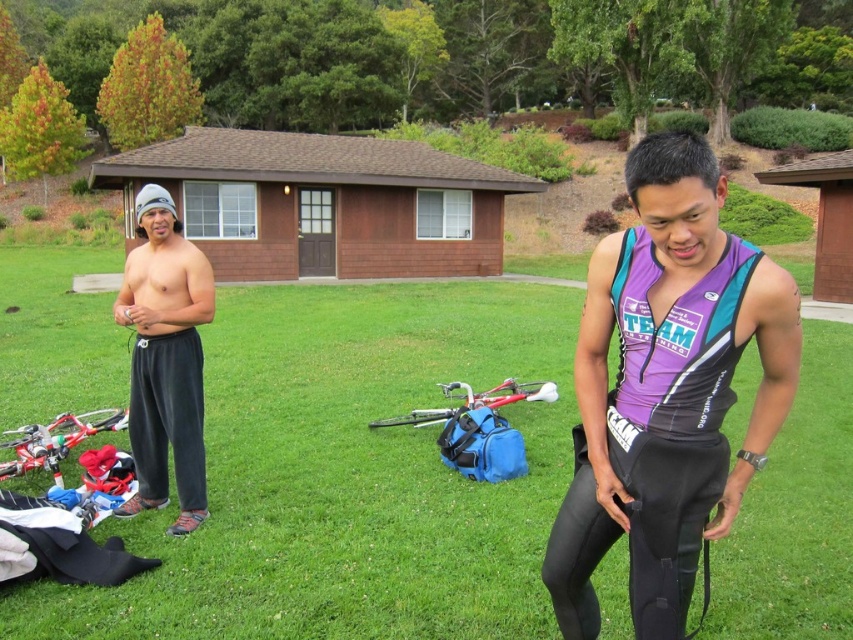
Question: Estimate the real-world distances between objects in this image. Which object is farther from the purple fabric triathlon suit at center?

Choices:
 (A) gray sweatpants at left
 (B) green grass at center

Answer: (B)

Question: Is green grass at center to the left of purple fabric triathlon suit at center from the viewer's perspective?

Choices:
 (A) yes
 (B) no

Answer: (A)

Question: Which point appears farthest from the camera in this image?

Choices:
 (A) (94, 605)
 (B) (585, 515)
 (C) (207, 278)

Answer: (C)

Question: From the image, what is the correct spatial relationship of green grass at center in relation to gray sweatpants at left?

Choices:
 (A) right
 (B) left

Answer: (A)

Question: Which object appears closest to the camera in this image?

Choices:
 (A) green grass at center
 (B) purple fabric triathlon suit at center
 (C) gray sweatpants at left

Answer: (B)

Question: Is green grass at center further to the viewer compared to gray sweatpants at left?

Choices:
 (A) yes
 (B) no

Answer: (B)